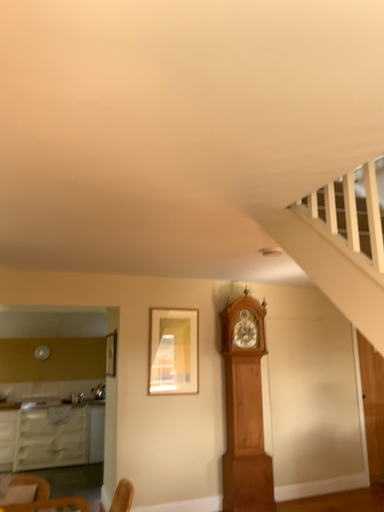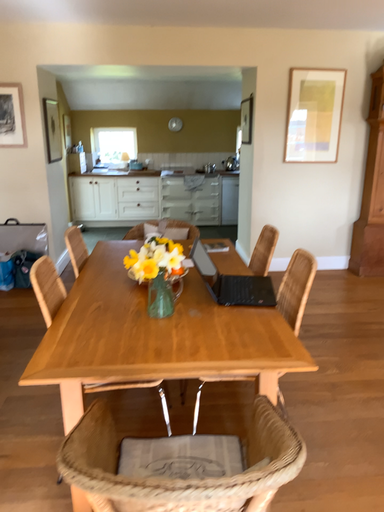
Question: Which way did the camera rotate in the video?

Choices:
 (A) rotated upward
 (B) rotated downward

Answer: (B)